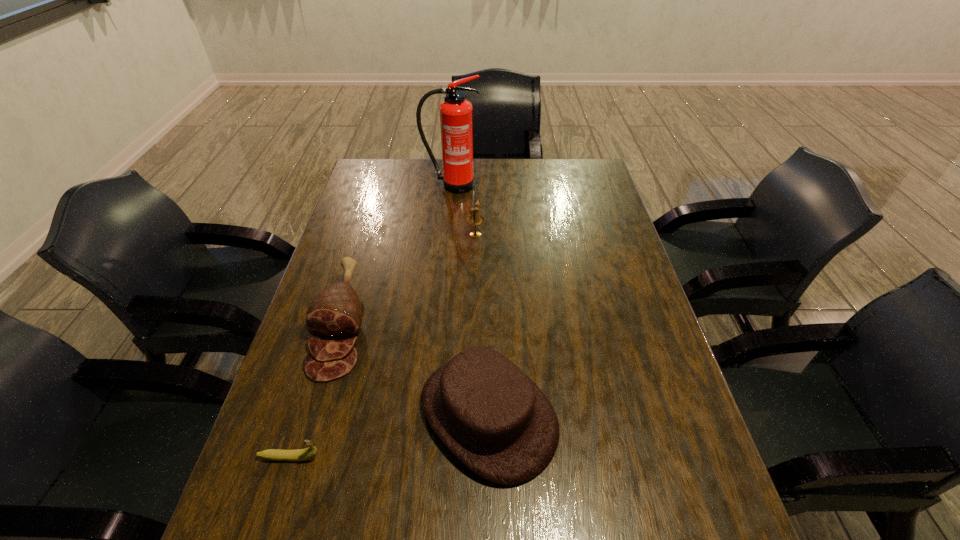
Image resolution: width=960 pixels, height=540 pixels. I want to click on the tallest object, so click(x=456, y=113).

Where is `fire extinguisher`? fire extinguisher is located at coordinates (456, 113).

Where is `candle holder`? This screenshot has height=540, width=960. candle holder is located at coordinates (475, 219).

Identify the location of hat. This screenshot has width=960, height=540. (489, 414).

This screenshot has width=960, height=540. In order to click on ham in this screenshot , I will do `click(336, 313)`.

In order to click on banana in this screenshot , I will do `click(271, 454)`.

I want to click on free space located 0.120m at the nozzle of the fire extinguisher, so click(448, 214).

Find the location of a particular element. free space located 0.060m on the right of the fourth nearest object is located at coordinates pos(503,234).

Where is `free spot located on the back of the hat`? This screenshot has height=540, width=960. free spot located on the back of the hat is located at coordinates (486, 250).

At what (x,y) coordinates should I click in order to perform the action: click on free location located at the sliced end of the ham. Please return your answer as a coordinate pair (x, y). Image resolution: width=960 pixels, height=540 pixels. Looking at the image, I should click on (313, 419).